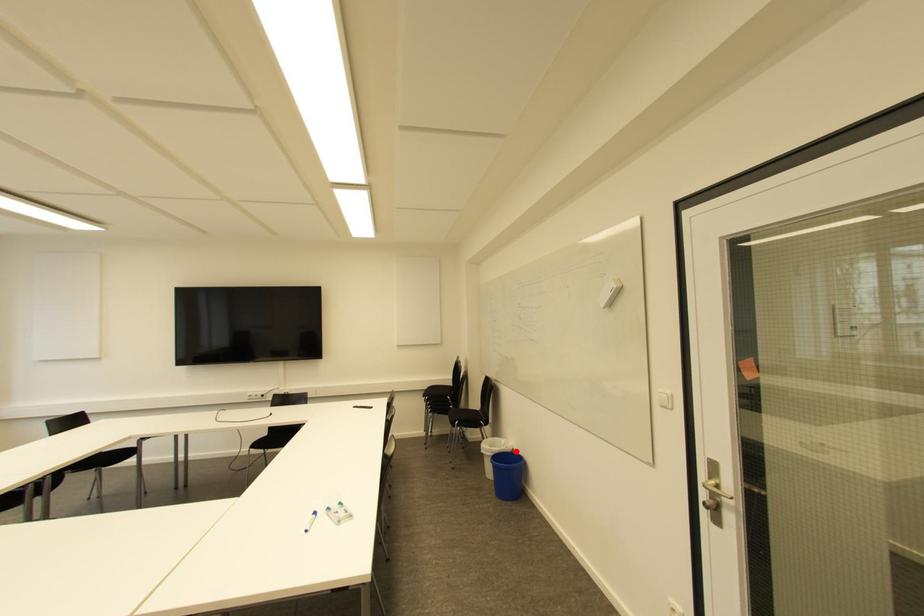
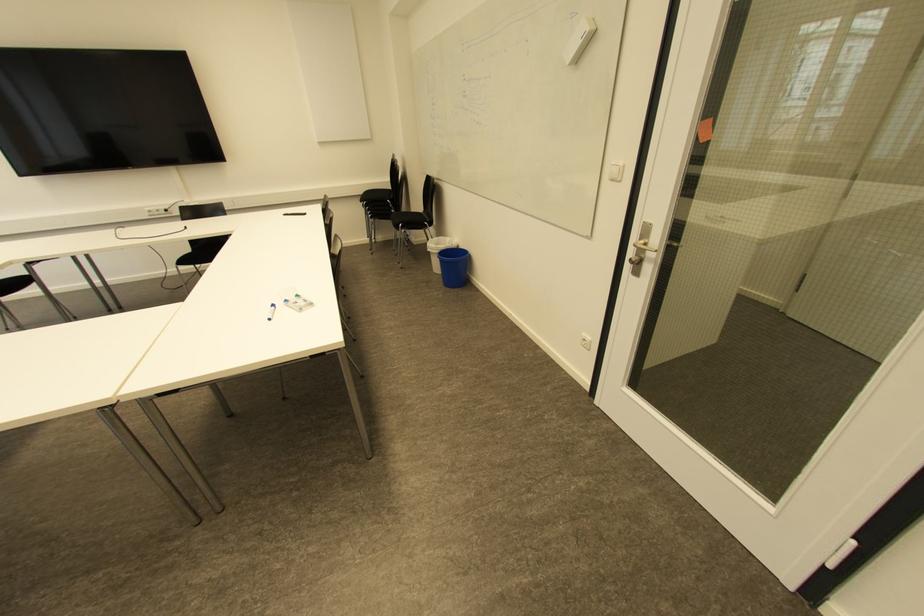
Where in the second image is the point corresponding to the highlighted location from the first image?

(460, 246)